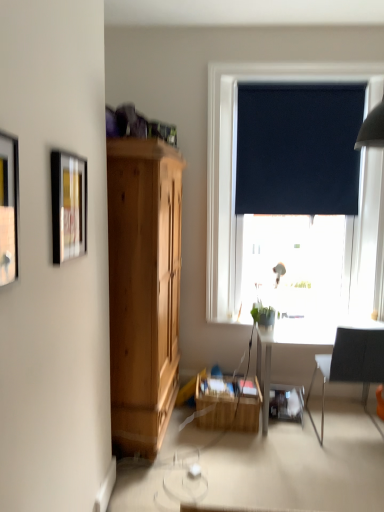
Question: From the image's perspective, is black fabric curtain at upper right on black fabric chair at right?

Choices:
 (A) yes
 (B) no

Answer: (A)

Question: Can you confirm if black fabric curtain at upper right is shorter than black fabric chair at right?

Choices:
 (A) no
 (B) yes

Answer: (A)

Question: Can you confirm if black fabric curtain at upper right is positioned to the left of black fabric chair at right?

Choices:
 (A) no
 (B) yes

Answer: (B)

Question: Are black fabric curtain at upper right and black fabric chair at right beside each other?

Choices:
 (A) no
 (B) yes

Answer: (A)

Question: From a real-world perspective, is black fabric curtain at upper right on black fabric chair at right?

Choices:
 (A) no
 (B) yes

Answer: (B)

Question: Can you confirm if black fabric curtain at upper right is positioned to the right of black fabric chair at right?

Choices:
 (A) no
 (B) yes

Answer: (A)

Question: From a real-world perspective, is black fabric curtain at upper right beneath green matte plant at lower center?

Choices:
 (A) no
 (B) yes

Answer: (A)

Question: Does black fabric curtain at upper right have a greater height compared to green matte plant at lower center?

Choices:
 (A) yes
 (B) no

Answer: (A)

Question: Does black fabric curtain at upper right have a greater width compared to green matte plant at lower center?

Choices:
 (A) yes
 (B) no

Answer: (B)

Question: Can you confirm if black fabric curtain at upper right is bigger than green matte plant at lower center?

Choices:
 (A) no
 (B) yes

Answer: (B)

Question: Is the position of black fabric curtain at upper right more distant than that of green matte plant at lower center?

Choices:
 (A) yes
 (B) no

Answer: (A)

Question: Is black fabric curtain at upper right at the right side of green matte plant at lower center?

Choices:
 (A) yes
 (B) no

Answer: (A)

Question: Is the surface of matte black picture frame at left, positioned as the 1th picture frame in front-to-back order, in direct contact with green matte plant at lower center?

Choices:
 (A) yes
 (B) no

Answer: (B)